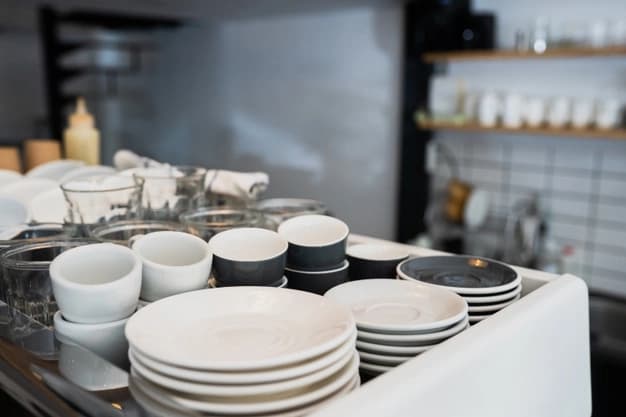
You are a GUI agent. You are given a task and a screenshot of the screen. Output one action in this format:
    pyautogui.click(x=<x>, y=<y>)
    Task: Click on the shelf
    The width and height of the screenshot is (626, 417).
    Given the screenshot: What is the action you would take?
    pyautogui.click(x=110, y=92), pyautogui.click(x=105, y=72), pyautogui.click(x=108, y=42), pyautogui.click(x=128, y=17), pyautogui.click(x=548, y=128), pyautogui.click(x=531, y=50)